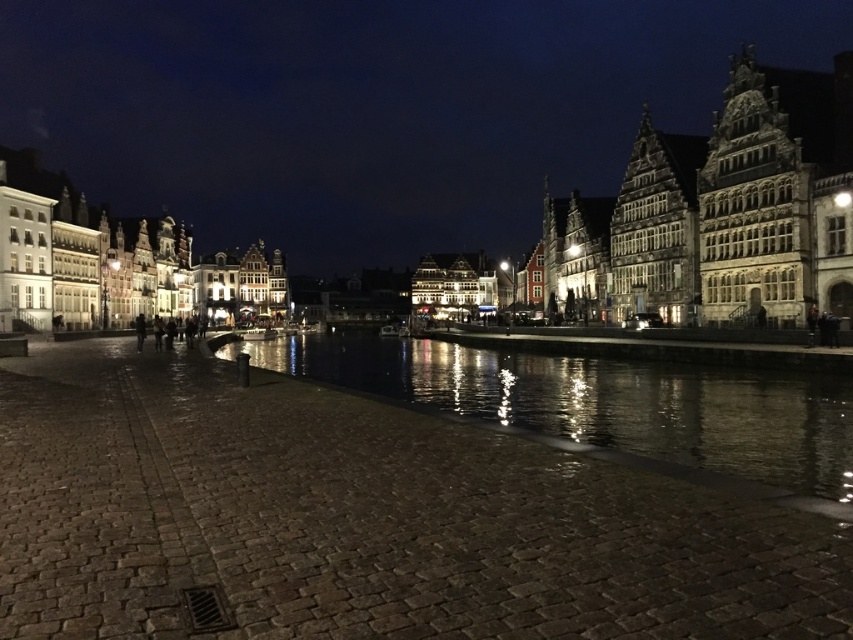
Question: Is stone buildings at center bigger than reflective dark water at center?

Choices:
 (A) no
 (B) yes

Answer: (B)

Question: Among these objects, which one is farthest from the camera?

Choices:
 (A) reflective dark water at center
 (B) stone buildings at center

Answer: (B)

Question: Which point appears farthest from the camera in this image?

Choices:
 (A) (253, 148)
 (B) (724, 371)

Answer: (A)

Question: Where is stone buildings at center located in relation to reflective dark water at center in the image?

Choices:
 (A) below
 (B) above

Answer: (B)

Question: Does stone buildings at center appear on the left side of reflective dark water at center?

Choices:
 (A) yes
 (B) no

Answer: (A)